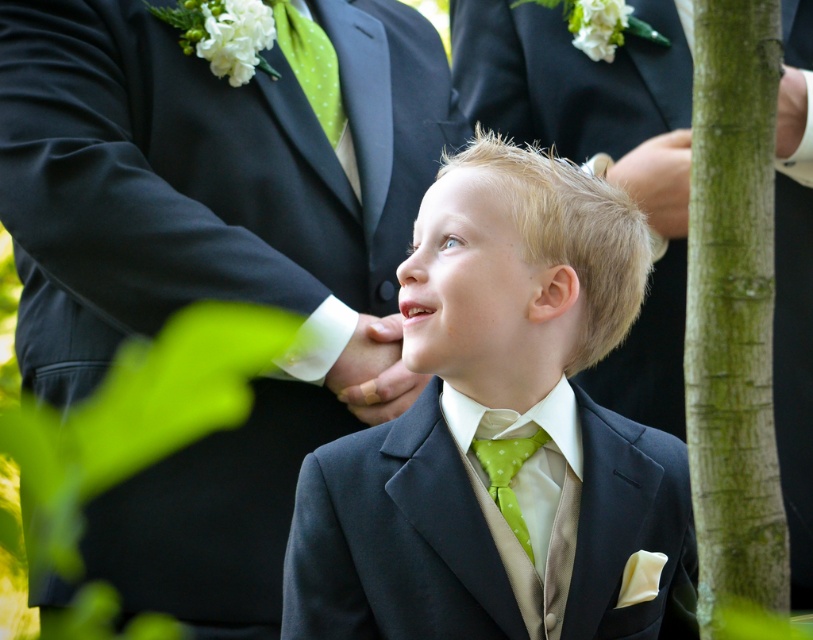
Where is `matte black suit at center`? matte black suit at center is located at coordinates (503, 435).

Based on the photo, does matte black suit at center have a smaller size compared to green dotted fabric tie at center?

No.

Between point (450, 522) and point (541, 444), which one is positioned behind?

Point (541, 444)

Where is `matte black suit at center`? This screenshot has width=813, height=640. matte black suit at center is located at coordinates (503, 435).

Which is more to the left, green rough bark at right or matte green nose at center?

From the viewer's perspective, matte green nose at center appears more on the left side.

Is green rough bark at right thinner than matte green nose at center?

Incorrect, green rough bark at right's width is not less than matte green nose at center's.

The width and height of the screenshot is (813, 640). What do you see at coordinates (733, 323) in the screenshot?
I see `green rough bark at right` at bounding box center [733, 323].

Where is `green rough bark at right`? This screenshot has height=640, width=813. green rough bark at right is located at coordinates (733, 323).

In the scene shown: How far apart are green rough bark at right and green dotted fabric tie at center?

green rough bark at right and green dotted fabric tie at center are 20.72 inches apart from each other.

Between green rough bark at right and green dotted fabric tie at center, which one has less height?

green dotted fabric tie at center

Does point (733, 88) lie behind point (522, 456)?

No, (733, 88) is closer to viewer.

Identify the location of green rough bark at right. (733, 323).